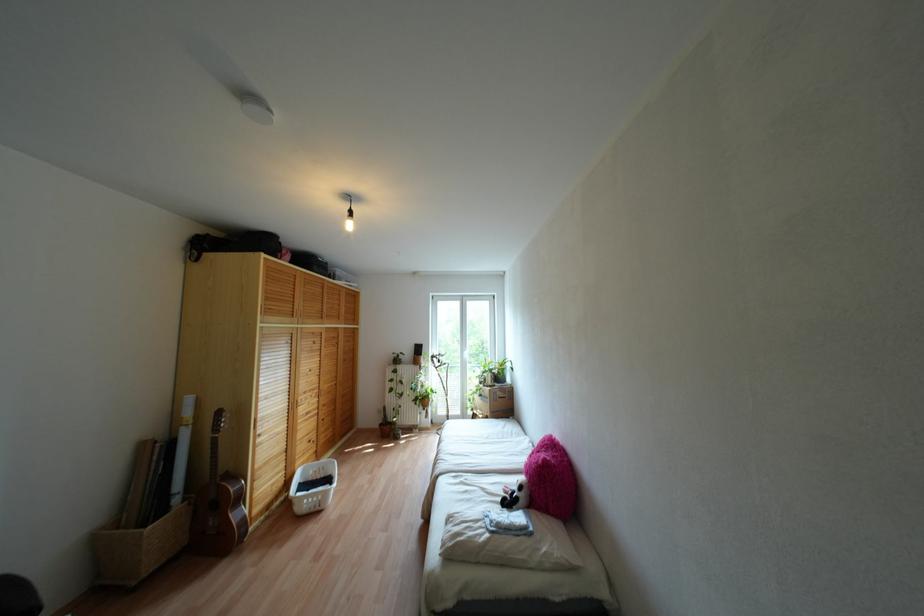
At what (x,y) coordinates should I click in order to perform the action: click on pink furry pillow. Please return your answer as a coordinate pair (x, y). The image size is (924, 616). Looking at the image, I should click on (551, 479).